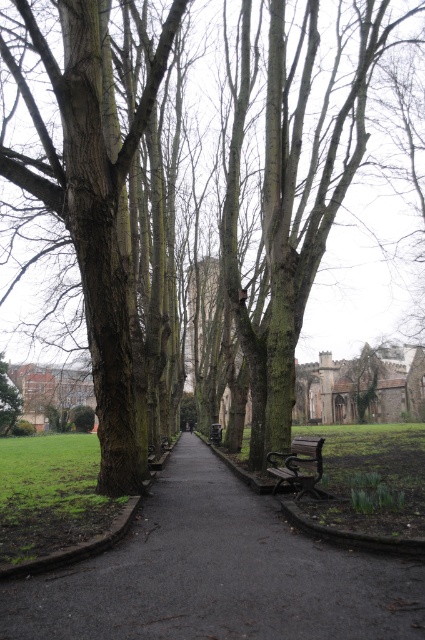
You are standing at the point with coordinates point (57, 573) and want to walk towards the historic building in the distance. Is the point (306, 474) behind you or in front of you?

The point (306, 474) is behind you because point (57, 573) is in front of it.

You are a bird looking for a higher perch to survey the park. Which tree would you choose between the green mossy bark tree at center and the dark brown bark tree at left?

The green mossy bark tree at center is much taller than the dark brown bark tree at left, so you should choose the green mossy bark tree at center for a higher perch to survey the park.